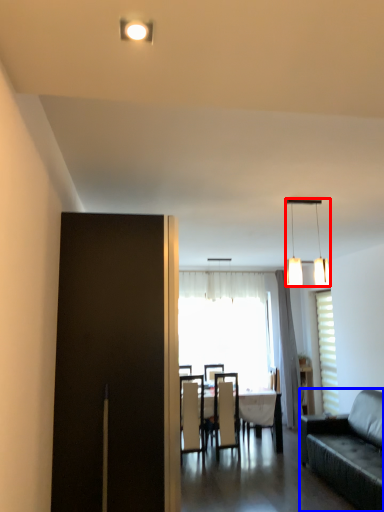
Question: Among these objects, which one is farthest to the camera, lamp (highlighted by a red box) or studio couch (highlighted by a blue box)?

Choices:
 (A) lamp
 (B) studio couch

Answer: (B)